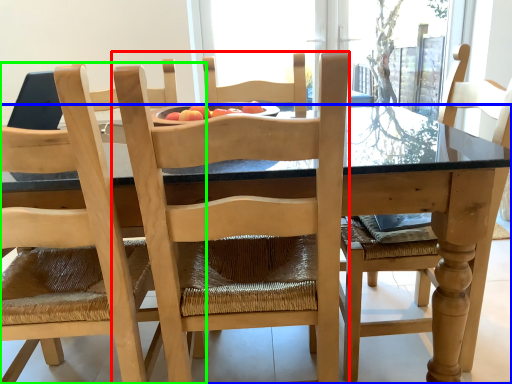
Question: Estimate the real-world distances between objects in this image. Which object is closer to chair (highlighted by a red box), kitchen & dining room table (highlighted by a blue box) or chair (highlighted by a green box)?

Choices:
 (A) kitchen & dining room table
 (B) chair

Answer: (B)